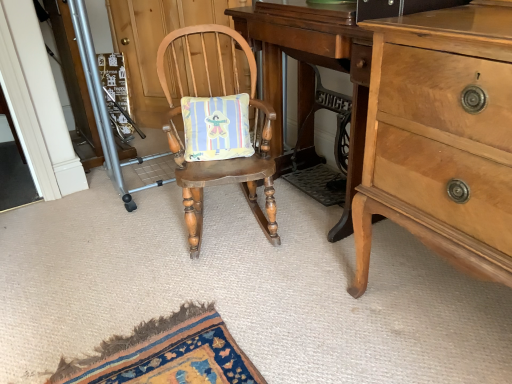
Question: Is light brown wood dresser at right located outside light brown wood changing table at center?

Choices:
 (A) yes
 (B) no

Answer: (A)

Question: Considering the relative sizes of light brown wood dresser at right and light brown wood changing table at center in the image provided, is light brown wood dresser at right taller than light brown wood changing table at center?

Choices:
 (A) no
 (B) yes

Answer: (B)

Question: Can you confirm if light brown wood dresser at right is thinner than light brown wood changing table at center?

Choices:
 (A) yes
 (B) no

Answer: (B)

Question: Is light brown wood dresser at right to the left of light brown wood changing table at center from the viewer's perspective?

Choices:
 (A) yes
 (B) no

Answer: (B)

Question: Can you confirm if light brown wood dresser at right is wider than light brown wood changing table at center?

Choices:
 (A) yes
 (B) no

Answer: (A)

Question: Can light brown wood changing table at center be found inside light brown wood dresser at right?

Choices:
 (A) yes
 (B) no

Answer: (B)

Question: Is light brown wood dresser at right oriented towards wooden rocking chair at center?

Choices:
 (A) yes
 (B) no

Answer: (B)

Question: Is light brown wood dresser at right shorter than wooden rocking chair at center?

Choices:
 (A) yes
 (B) no

Answer: (B)

Question: Can you confirm if light brown wood dresser at right is taller than wooden rocking chair at center?

Choices:
 (A) no
 (B) yes

Answer: (B)

Question: Can you confirm if light brown wood dresser at right is bigger than wooden rocking chair at center?

Choices:
 (A) no
 (B) yes

Answer: (B)

Question: Is light brown wood dresser at right behind wooden rocking chair at center?

Choices:
 (A) yes
 (B) no

Answer: (B)

Question: Is light brown wood dresser at right not within wooden rocking chair at center?

Choices:
 (A) yes
 (B) no

Answer: (A)

Question: Considering the relative sizes of metallic silver screen door at left and light brown wood dresser at right in the image provided, is metallic silver screen door at left shorter than light brown wood dresser at right?

Choices:
 (A) yes
 (B) no

Answer: (B)